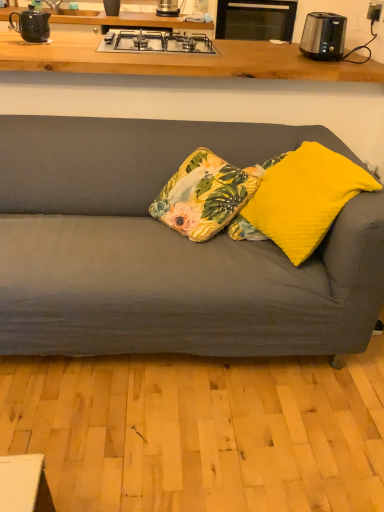
Question: Considering the relative positions of floral fabric cushion at center, the third pillow positioned from the right, and yellow fabric pillow at center, the 2th pillow from the right, in the image provided, is floral fabric cushion at center, the third pillow positioned from the right, to the right of yellow fabric pillow at center, the 2th pillow from the right, from the viewer's perspective?

Choices:
 (A) no
 (B) yes

Answer: (A)

Question: From a real-world perspective, is floral fabric cushion at center, the third pillow positioned from the right, physically above yellow fabric pillow at center, the 2th pillow from the right?

Choices:
 (A) no
 (B) yes

Answer: (A)

Question: Is floral fabric cushion at center, the third pillow positioned from the right, located outside yellow fabric pillow at center, which is the second pillow from left to right?

Choices:
 (A) yes
 (B) no

Answer: (A)

Question: Is floral fabric cushion at center, which ranks as the first pillow in left-to-right order, touching yellow fabric pillow at center, the 2th pillow from the right?

Choices:
 (A) no
 (B) yes

Answer: (A)

Question: Can you confirm if floral fabric cushion at center, which ranks as the first pillow in left-to-right order, is positioned to the left of yellow fabric pillow at center, the 2th pillow from the right?

Choices:
 (A) yes
 (B) no

Answer: (A)

Question: Is silver metallic gas stove at upper center in front of or behind yellow fabric pillow at center, the 2th pillow from the right, in the image?

Choices:
 (A) behind
 (B) front

Answer: (A)

Question: From a real-world perspective, relative to yellow fabric pillow at center, which is the second pillow from left to right, is silver metallic gas stove at upper center vertically above or below?

Choices:
 (A) above
 (B) below

Answer: (A)

Question: Considering the positions of silver metallic gas stove at upper center and yellow fabric pillow at center, which is the second pillow from left to right, in the image, is silver metallic gas stove at upper center bigger or smaller than yellow fabric pillow at center, which is the second pillow from left to right,?

Choices:
 (A) big
 (B) small

Answer: (B)

Question: Is point (190, 42) positioned closer to the camera than point (243, 219)?

Choices:
 (A) farther
 (B) closer

Answer: (A)

Question: Do you think yellow fabric pillow at center, the 2th pillow from the right, is within matte black teapot at upper left, or outside of it?

Choices:
 (A) inside
 (B) outside

Answer: (B)

Question: From the image's perspective, is yellow fabric pillow at center, the 2th pillow from the right, located above or below matte black teapot at upper left?

Choices:
 (A) above
 (B) below

Answer: (B)

Question: In terms of width, does yellow fabric pillow at center, the 2th pillow from the right, look wider or thinner when compared to matte black teapot at upper left?

Choices:
 (A) wide
 (B) thin

Answer: (A)

Question: Considering the positions of yellow fabric pillow at center, which is the second pillow from left to right, and matte black teapot at upper left in the image, is yellow fabric pillow at center, which is the second pillow from left to right, taller or shorter than matte black teapot at upper left?

Choices:
 (A) short
 (B) tall

Answer: (B)

Question: Considering the positions of floral fabric cushion at center, which ranks as the first pillow in left-to-right order, and silver metallic gas stove at upper center in the image, is floral fabric cushion at center, which ranks as the first pillow in left-to-right order, wider or thinner than silver metallic gas stove at upper center?

Choices:
 (A) wide
 (B) thin

Answer: (B)

Question: From the image's perspective, relative to silver metallic gas stove at upper center, is floral fabric cushion at center, the third pillow positioned from the right, above or below?

Choices:
 (A) above
 (B) below

Answer: (B)